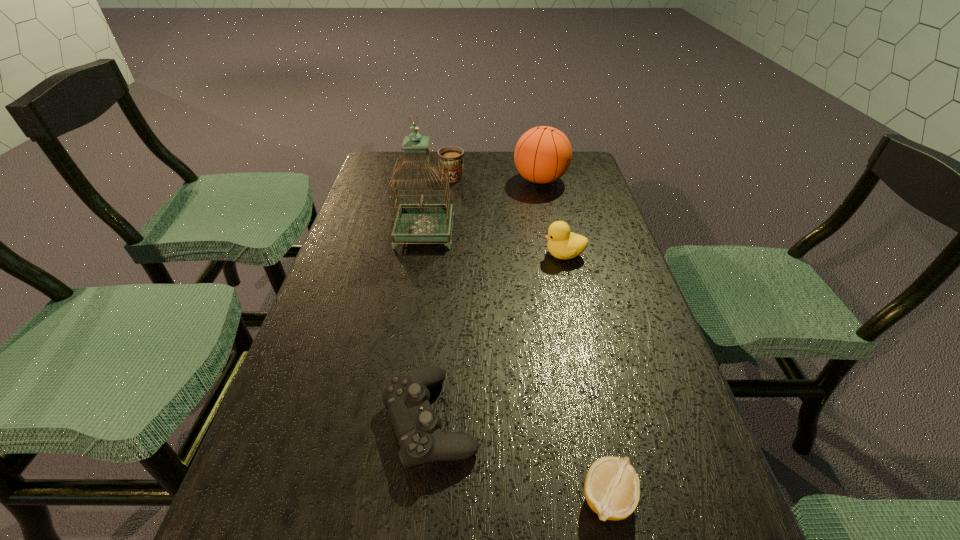
The image size is (960, 540). Identify the location of vacant space that satisfies the following two spatial constraints: 1. on the back side of the shortest object; 2. at the door of the tallest object. (552, 232).